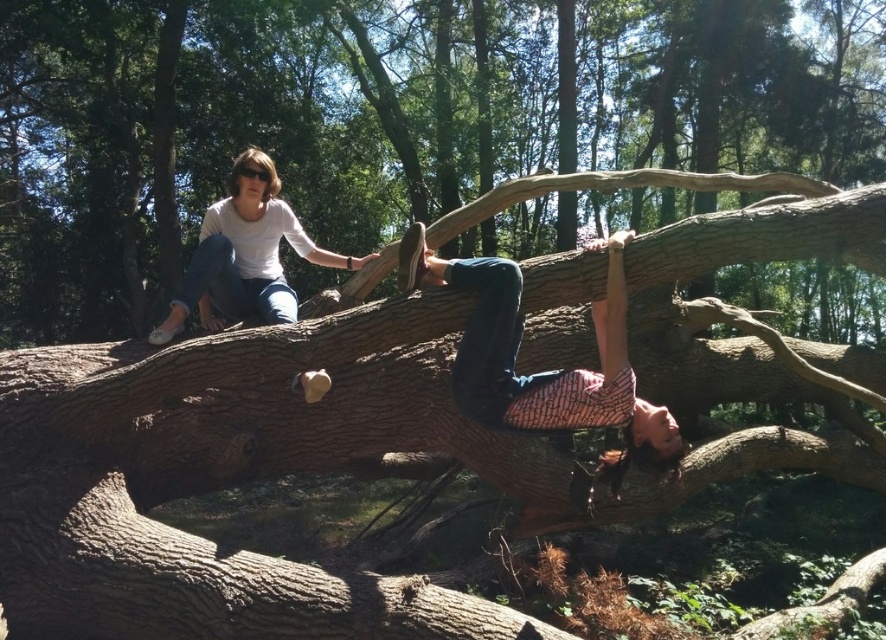
You are a photographer positioned at the bottom of the image. You want to capture a closeup of the patterned fabric shirt at upper center. Which direction should you move your camera to focus on it?

You should move your camera upwards and towards the center of the image to focus on the patterned fabric shirt at upper center.

Looking at this image, you are standing in the forest and see two points marked on the large fallen tree trunk. The points are labeled as point [464,280] and point [236,300]. Which of these points is nearer to you?

Point [464,280] is closer to the viewer than point [236,300].

You are a photographer trying to capture a candid shot of both the patterned fabric shirt at upper center and the white matte shirt at upper left. Since you want to ensure both subjects are in frame, can you determine if they are positioned side by side horizontally?

The patterned fabric shirt at upper center is positioned on the right side of the white matte shirt at upper left, so they are positioned side by side horizontally.